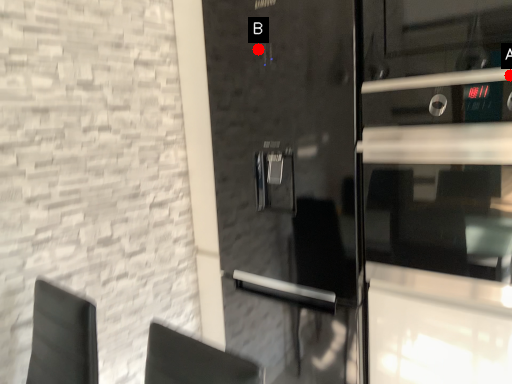
Question: Two points are circled on the image, labeled by A and B beside each circle. Which point is further to the camera?

Choices:
 (A) A is further
 (B) B is further

Answer: (B)